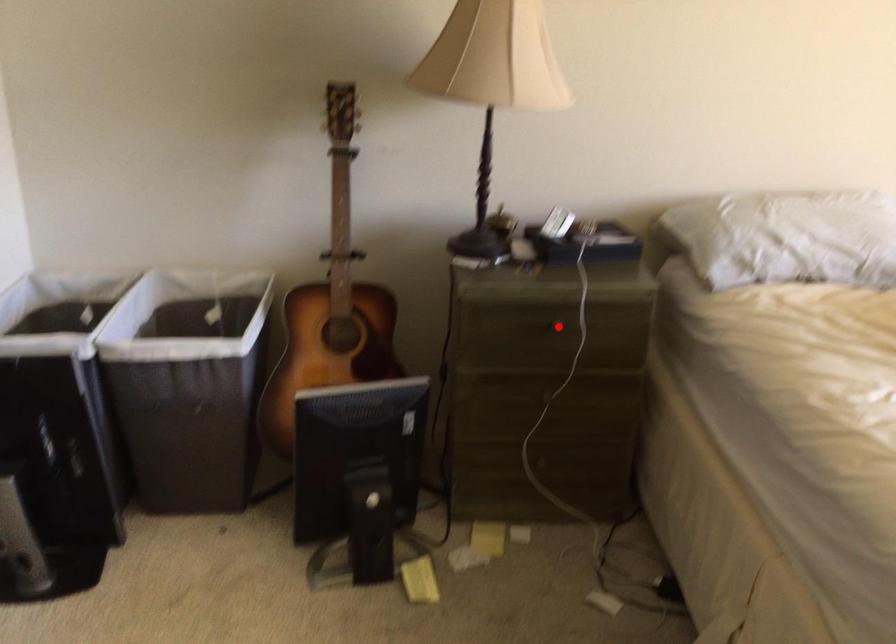
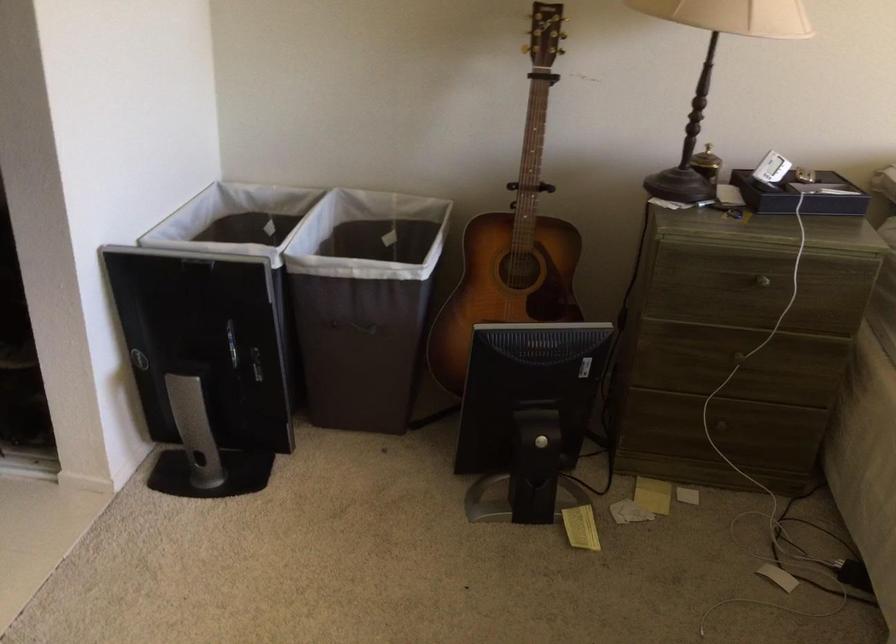
In the second image, find the point that corresponds to the highlighted location in the first image.

(762, 281)